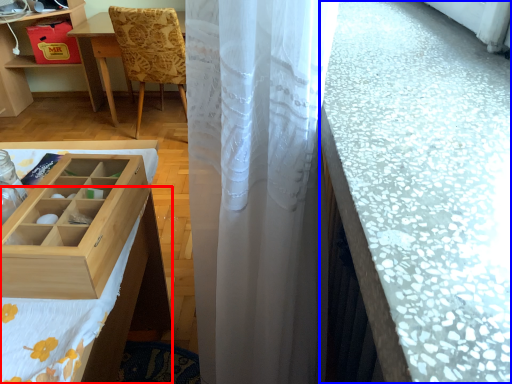
Question: Among these objects, which one is farthest to the camera, tablecloth (highlighted by a red box) or counter top (highlighted by a blue box)?

Choices:
 (A) tablecloth
 (B) counter top

Answer: (A)